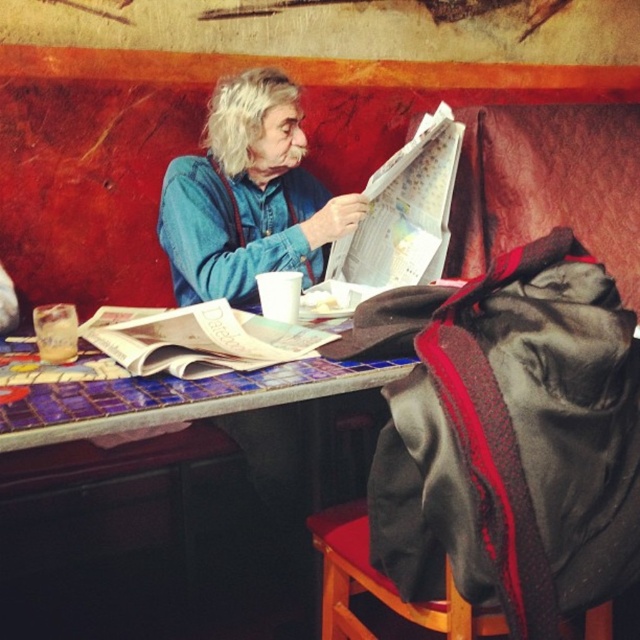
Which is in front, point (182, 346) or point (326, 538)?

Point (182, 346) is in front.

Does white glossy newspaper at center appear over wooden stool at lower right?

Indeed, white glossy newspaper at center is positioned over wooden stool at lower right.

Who is more forward, (250,346) or (368,568)?

Point (250,346) is more forward.

Where is `white glossy newspaper at center`? This screenshot has height=640, width=640. white glossy newspaper at center is located at coordinates (198, 340).

Locate an element on the screen. black fleece blanket at lower right is located at coordinates (515, 440).

Does point (544, 481) come farther from viewer compared to point (243, 157)?

No, (544, 481) is closer to viewer.

Where is `black fleece blanket at lower right`? black fleece blanket at lower right is located at coordinates (515, 440).

At what (x,y) coordinates should I click in order to perform the action: click on blue mosaic tile table at center. Please return your answer as a coordinate pair (x, y). Looking at the image, I should click on pos(147,544).

Does blue mosaic tile table at center have a larger size compared to white glossy newspaper at center?

Indeed, blue mosaic tile table at center has a larger size compared to white glossy newspaper at center.

Is point (125, 624) farther from camera compared to point (278, 339)?

Yes, it is.

You are a GUI agent. You are given a task and a screenshot of the screen. Output one action in this format:
    pyautogui.click(x=<x>, y=<y>)
    Task: Click on the blue mosaic tile table at center
    
    Given the screenshot: What is the action you would take?
    pyautogui.click(x=147, y=544)